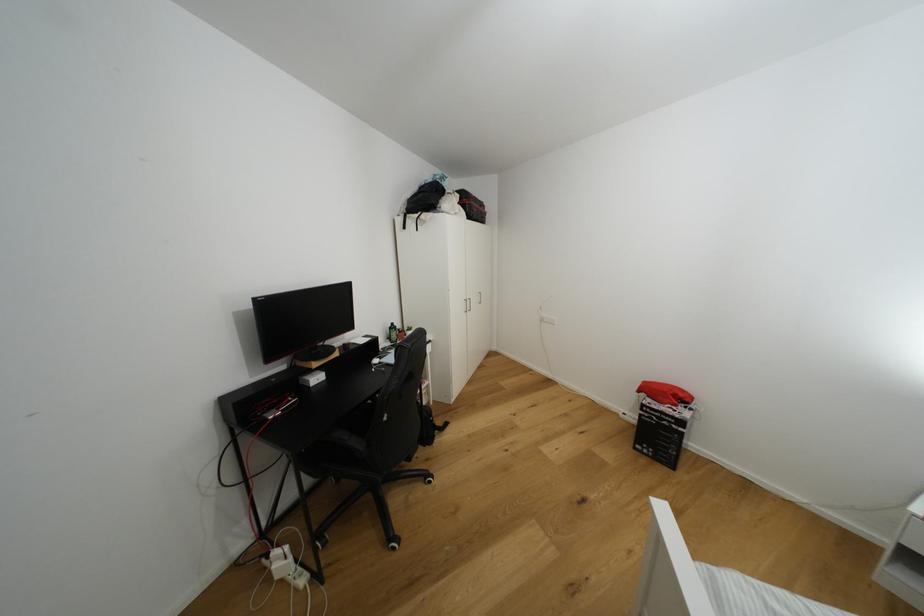
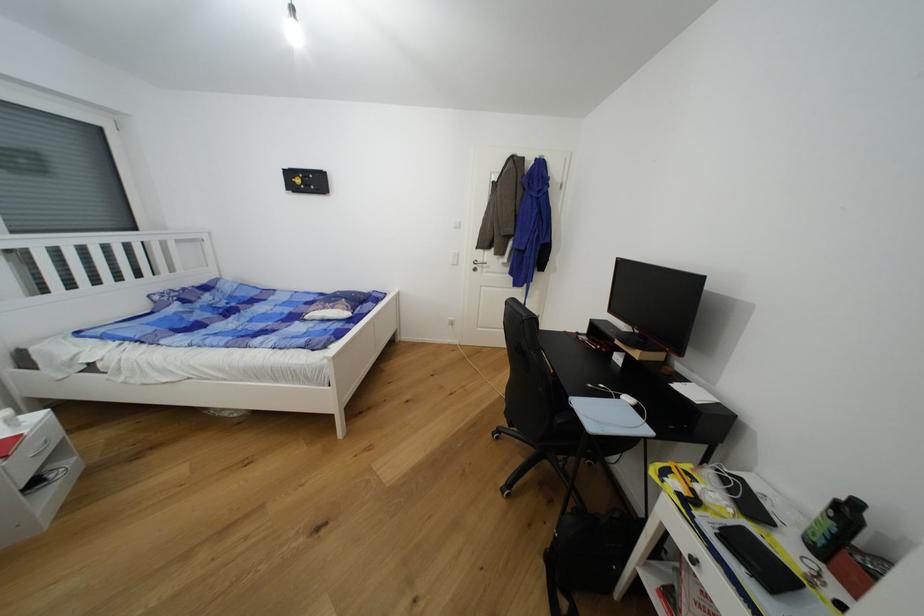
Find the pixel in the second image that matches (397,325) in the first image.

(862, 506)